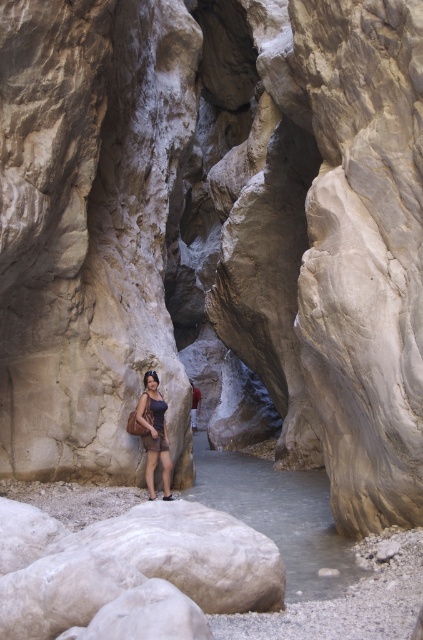
You are a hiker who wants to cross the canyon floor. You see clear water at center and a matte purple dress at center. Which object is positioned to the right of the other?

The clear water at center is to the right of the matte purple dress at center.

You are a hiker who wants to cross the canyon. You see clear water at center and a matte purple dress at center. Which object is closer to you?

The clear water at center is closer to you because it is in front of the matte purple dress at center.

You are a photographer planning to take a photo of the canyon. You notice the matte purple dress at center and the red fabric shirt at center in the scene. Which clothing item would be more visible to someone standing at the entrance of the canyon?

The matte purple dress at center is in front of the red fabric shirt at center, so it would be more visible to someone at the entrance of the canyon.